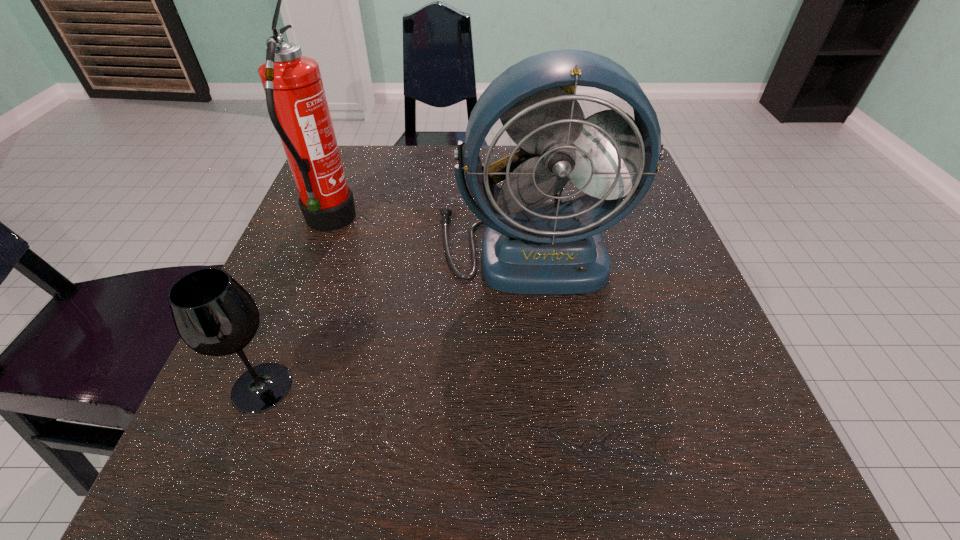
This screenshot has width=960, height=540. In order to click on free space that satisfies the following two spatial constraints: 1. on the front-facing side of the fire extinguisher; 2. on the front side of the nearest object in this screenshot , I will do `click(264, 387)`.